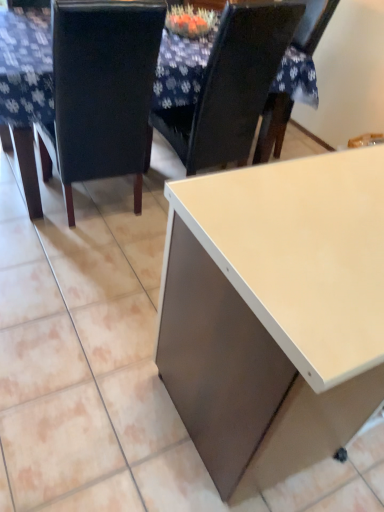
Question: Is matte white desk at lower right bigger or smaller than black leather chair at left, which appears as the second chair when viewed from the right?

Choices:
 (A) small
 (B) big

Answer: (B)

Question: Considering the relative positions of matte white desk at lower right and black leather chair at left, the 1th chair in the left-to-right sequence, in the image provided, is matte white desk at lower right to the left or to the right of black leather chair at left, the 1th chair in the left-to-right sequence,?

Choices:
 (A) right
 (B) left

Answer: (A)

Question: Considering the real-world distances, which object is farthest from the black leather chair at left, the 1th chair in the left-to-right sequence?

Choices:
 (A) matte white desk at lower right
 (B) matte black chair at upper center, acting as the 1th chair starting from the right
 (C) white glossy table at center

Answer: (A)

Question: Which is nearer to the black leather chair at left, which appears as the second chair when viewed from the right?

Choices:
 (A) white glossy table at center
 (B) matte white desk at lower right
 (C) matte black chair at upper center, acting as the 1th chair starting from the right

Answer: (A)